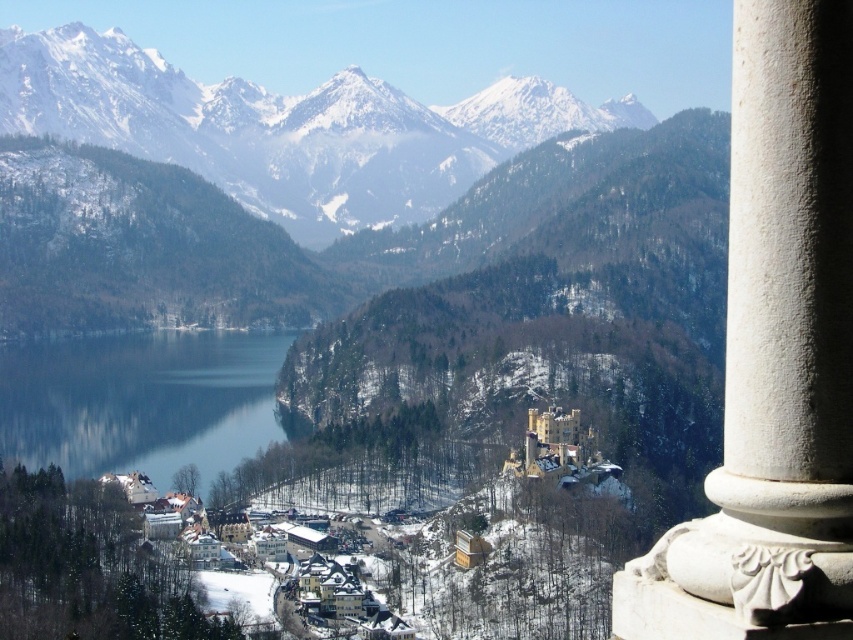
Is point (747, 557) in front of point (22, 451)?

Yes.

Between white stone column at right and blue glass water at center, which one has less height?

blue glass water at center is shorter.

At what (x,y) coordinates should I click in order to perform the action: click on white stone column at right. Please return your answer as a coordinate pair (x, y). Looking at the image, I should click on (775, 356).

Is white stone column at right taller than snowy granite mountains at upper left?

Incorrect, white stone column at right's height is not larger of snowy granite mountains at upper left's.

Does white stone column at right appear on the left side of snowy granite mountains at upper left?

In fact, white stone column at right is to the right of snowy granite mountains at upper left.

Where is `white stone column at right`? The width and height of the screenshot is (853, 640). white stone column at right is located at coordinates (775, 356).

The image size is (853, 640). I want to click on white stone column at right, so click(775, 356).

Is point (201, 138) positioned before point (77, 436)?

No, it is behind (77, 436).

Is point (404, 160) more distant than point (242, 364)?

Yes, point (404, 160) is farther from viewer.

Where is `snowy granite mountains at upper left`? snowy granite mountains at upper left is located at coordinates (285, 129).